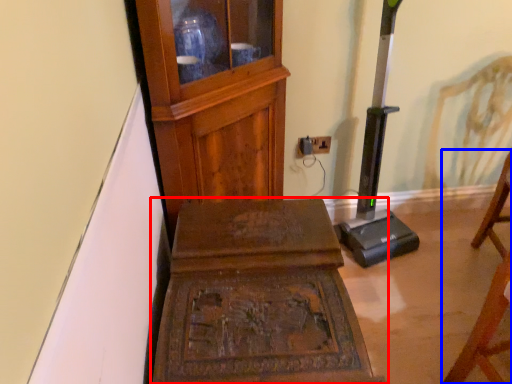
Question: Among these objects, which one is nearest to the camera, furniture (highlighted by a red box) or furniture (highlighted by a blue box)?

Choices:
 (A) furniture
 (B) furniture

Answer: (B)